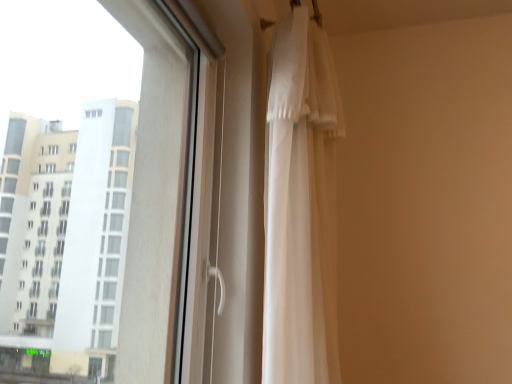
Question: Is white sheer curtain at right at the right side of transparent glass window at upper left?

Choices:
 (A) no
 (B) yes

Answer: (B)

Question: Is white sheer curtain at right oriented towards transparent glass window at upper left?

Choices:
 (A) no
 (B) yes

Answer: (A)

Question: From the image's perspective, is white sheer curtain at right beneath transparent glass window at upper left?

Choices:
 (A) yes
 (B) no

Answer: (A)

Question: Can you confirm if white sheer curtain at right is smaller than transparent glass window at upper left?

Choices:
 (A) no
 (B) yes

Answer: (B)

Question: Is white sheer curtain at right positioned with its back to transparent glass window at upper left?

Choices:
 (A) no
 (B) yes

Answer: (A)

Question: Would you say transparent glass window at upper left is part of white sheer curtain at right's contents?

Choices:
 (A) no
 (B) yes

Answer: (A)

Question: Considering the relative sizes of transparent glass window at upper left and white sheer curtain at right in the image provided, is transparent glass window at upper left smaller than white sheer curtain at right?

Choices:
 (A) no
 (B) yes

Answer: (A)

Question: Considering the relative sizes of transparent glass window at upper left and white sheer curtain at right in the image provided, is transparent glass window at upper left bigger than white sheer curtain at right?

Choices:
 (A) no
 (B) yes

Answer: (B)

Question: Is transparent glass window at upper left further to camera compared to white sheer curtain at right?

Choices:
 (A) no
 (B) yes

Answer: (A)

Question: Is transparent glass window at upper left wider than white sheer curtain at right?

Choices:
 (A) no
 (B) yes

Answer: (B)

Question: Can you confirm if transparent glass window at upper left is positioned to the right of white sheer curtain at right?

Choices:
 (A) yes
 (B) no

Answer: (B)

Question: Is transparent glass window at upper left thinner than white sheer curtain at right?

Choices:
 (A) no
 (B) yes

Answer: (A)

Question: Is point (342, 135) positioned closer to the camera than point (11, 299)?

Choices:
 (A) closer
 (B) farther

Answer: (A)